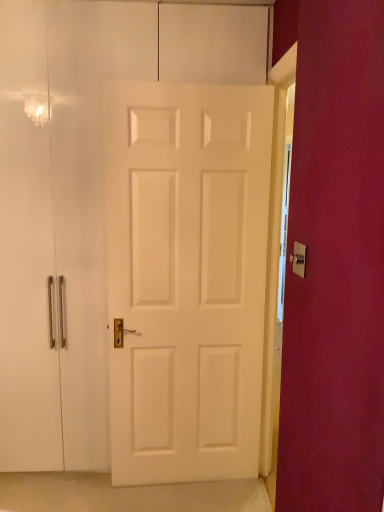
This screenshot has height=512, width=384. What do you see at coordinates (186, 278) in the screenshot? I see `white matte door at center` at bounding box center [186, 278].

The height and width of the screenshot is (512, 384). In order to click on white matte door at center in this screenshot , I will do `click(186, 278)`.

This screenshot has height=512, width=384. What do you see at coordinates (299, 259) in the screenshot?
I see `gold metallic door handle at center` at bounding box center [299, 259].

This screenshot has height=512, width=384. Identify the location of gold metallic door handle at center. (299, 259).

Identify the location of white matte door at center. The height and width of the screenshot is (512, 384). (186, 278).

Which object is positioned more to the right, gold metallic door handle at center or white matte door at center?

gold metallic door handle at center.

Considering the relative positions of gold metallic door handle at center and white matte door at center in the image provided, is gold metallic door handle at center in front of white matte door at center?

Yes, gold metallic door handle at center is in front of white matte door at center.

Between point (296, 242) and point (141, 266), which one is positioned in front?

Point (296, 242)

From the image's perspective, which is above, gold metallic door handle at center or white matte door at center?

gold metallic door handle at center appears higher in the image.

From a real-world perspective, is gold metallic door handle at center physically below white matte door at center?

No, from a real-world perspective, gold metallic door handle at center is not beneath white matte door at center.

Is gold metallic door handle at center thinner than white matte door at center?

Yes, gold metallic door handle at center is thinner than white matte door at center.

Which of these two, gold metallic door handle at center or white matte door at center, stands shorter?

gold metallic door handle at center.

Is gold metallic door handle at center smaller than white matte door at center?

Correct, gold metallic door handle at center occupies less space than white matte door at center.

Is gold metallic door handle at center spatially inside white matte door at center, or outside of it?

gold metallic door handle at center is spatially situated outside white matte door at center.

Is gold metallic door handle at center in contact with white matte door at center?

There is a gap between gold metallic door handle at center and white matte door at center.

Is gold metallic door handle at center aimed at white matte door at center?

No, gold metallic door handle at center is not oriented towards white matte door at center.

What's the angular difference between gold metallic door handle at center and white matte door at center's facing directions?

There is a 89-degree angle between the facing directions of gold metallic door handle at center and white matte door at center.

How far apart are gold metallic door handle at center and white matte door at center?

gold metallic door handle at center is 1.05 meters away from white matte door at center.

What are the coordinates of `door handle that is above the white matte door at center (from a real-world perspective)` in the screenshot? It's located at (299, 259).

Considering the relative positions of white matte door at center and gold metallic door handle at center in the image provided, is white matte door at center to the left or to the right of gold metallic door handle at center?

Based on their positions, white matte door at center is located to the left of gold metallic door handle at center.

Is white matte door at center in front of gold metallic door handle at center?

Answer: No.

Between point (237, 119) and point (305, 261), which one is positioned behind?

The point (237, 119) is farther.

From the image's perspective, which one is positioned higher, white matte door at center or gold metallic door handle at center?

From the image's view, gold metallic door handle at center is above.

From a real-world perspective, is white matte door at center physically located above or below gold metallic door handle at center?

white matte door at center is situated lower than gold metallic door handle at center in the real world.

Considering the relative sizes of white matte door at center and gold metallic door handle at center in the image provided, is white matte door at center thinner than gold metallic door handle at center?

Result: No, white matte door at center is not thinner than gold metallic door handle at center.

Does white matte door at center have a greater height compared to gold metallic door handle at center?

Correct, white matte door at center is much taller as gold metallic door handle at center.

Who is smaller, white matte door at center or gold metallic door handle at center?

With smaller size is gold metallic door handle at center.

From the picture: Choose the correct answer: Is white matte door at center inside gold metallic door handle at center or outside it?

white matte door at center is outside gold metallic door handle at center.

Does white matte door at center touch gold metallic door handle at center?

white matte door at center is not next to gold metallic door handle at center, and they're not touching.

Is white matte door at center oriented towards gold metallic door handle at center?

Yes, white matte door at center is oriented towards gold metallic door handle at center.

Locate an element on the screen. door handle above the white matte door at center (from a real-world perspective) is located at coordinates (299, 259).

Find the location of `door below the gold metallic door handle at center (from a real-world perspective)`. door below the gold metallic door handle at center (from a real-world perspective) is located at coordinates (186, 278).

Where is `door handle in front of the white matte door at center`? The image size is (384, 512). door handle in front of the white matte door at center is located at coordinates (299, 259).